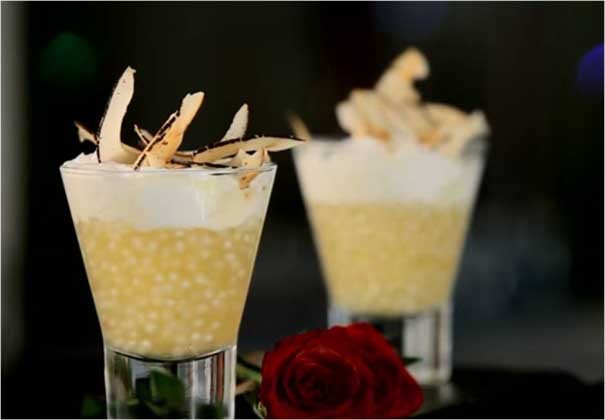
Where is `tabletop`? Image resolution: width=605 pixels, height=420 pixels. tabletop is located at coordinates (530, 392).